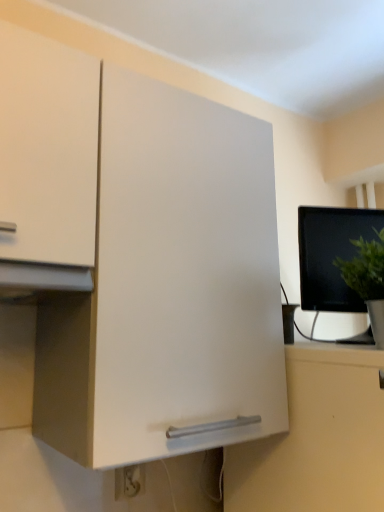
Question: Does green matte plant at right have a lesser height compared to white plastic electric outlet at lower center?

Choices:
 (A) no
 (B) yes

Answer: (A)

Question: From the image's perspective, is green matte plant at right located beneath white plastic electric outlet at lower center?

Choices:
 (A) no
 (B) yes

Answer: (A)

Question: Is green matte plant at right at the left side of white plastic electric outlet at lower center?

Choices:
 (A) yes
 (B) no

Answer: (B)

Question: Does green matte plant at right have a greater height compared to white plastic electric outlet at lower center?

Choices:
 (A) yes
 (B) no

Answer: (A)

Question: Does green matte plant at right have a lesser width compared to white plastic electric outlet at lower center?

Choices:
 (A) yes
 (B) no

Answer: (B)

Question: Choose the correct answer: Is black glossy monitor at right inside white plastic electric outlet at lower center or outside it?

Choices:
 (A) inside
 (B) outside

Answer: (B)

Question: Looking at the image, does black glossy monitor at right seem bigger or smaller compared to white plastic electric outlet at lower center?

Choices:
 (A) big
 (B) small

Answer: (A)

Question: Is point (309, 244) positioned closer to the camera than point (135, 472)?

Choices:
 (A) farther
 (B) closer

Answer: (A)

Question: Considering the positions of black glossy monitor at right and white plastic electric outlet at lower center in the image, is black glossy monitor at right wider or thinner than white plastic electric outlet at lower center?

Choices:
 (A) wide
 (B) thin

Answer: (A)

Question: From a real-world perspective, relative to black glossy monitor at right, is green matte plant at right vertically above or below?

Choices:
 (A) below
 (B) above

Answer: (A)

Question: Would you say green matte plant at right is inside or outside black glossy monitor at right?

Choices:
 (A) outside
 (B) inside

Answer: (A)

Question: In terms of width, does green matte plant at right look wider or thinner when compared to black glossy monitor at right?

Choices:
 (A) thin
 (B) wide

Answer: (B)

Question: Would you say green matte plant at right is to the left or to the right of black glossy monitor at right in the picture?

Choices:
 (A) right
 (B) left

Answer: (A)

Question: Considering the relative positions of black glossy monitor at right and green matte plant at right in the image provided, is black glossy monitor at right to the left or to the right of green matte plant at right?

Choices:
 (A) left
 (B) right

Answer: (A)

Question: Considering the positions of black glossy monitor at right and green matte plant at right in the image, is black glossy monitor at right taller or shorter than green matte plant at right?

Choices:
 (A) short
 (B) tall

Answer: (B)